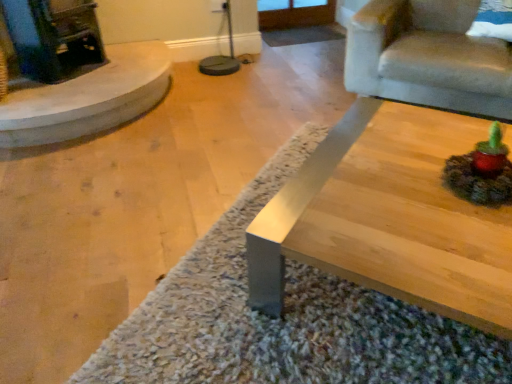
The height and width of the screenshot is (384, 512). In order to click on free space that is in between shaggy carpet at center and smooth beige fireplace at left in this screenshot , I will do pos(155,169).